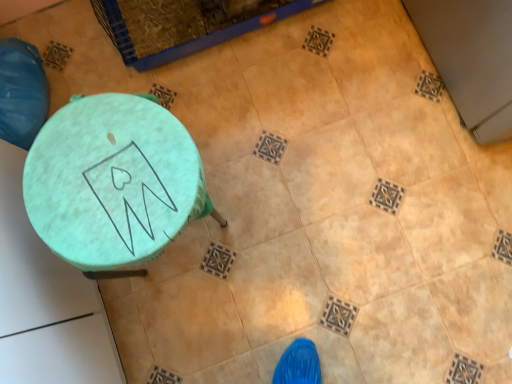
Identify the location of free space in front of teal fabric-covered stool at lower left. (190, 316).